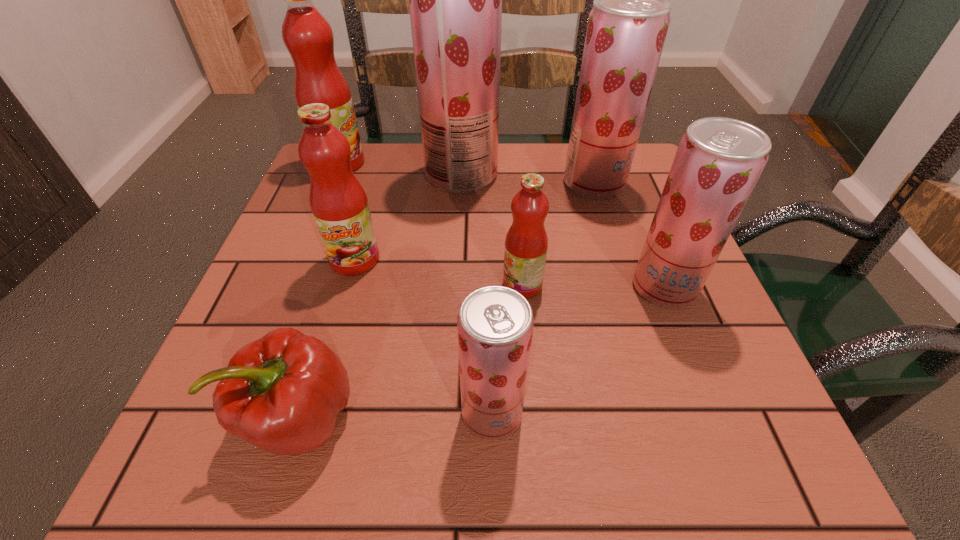
This screenshot has height=540, width=960. In order to click on vacant area situated on the back of the pepper in this screenshot , I will do `click(345, 269)`.

Where is `fruit juice at the near edge`? The image size is (960, 540). fruit juice at the near edge is located at coordinates (495, 324).

Locate an element on the screen. Image resolution: width=960 pixels, height=540 pixels. pepper situated at the near edge is located at coordinates (283, 392).

At what (x,y) coordinates should I click in order to perform the action: click on pepper that is at the left edge. Please return your answer as a coordinate pair (x, y). Looking at the image, I should click on (283, 392).

Identify the location of object that is at the far left corner. The image size is (960, 540). (307, 35).

The width and height of the screenshot is (960, 540). What are the coordinates of `object present at the near left corner` in the screenshot? It's located at (283, 392).

Where is `object located in the far right corner section of the desktop`? This screenshot has height=540, width=960. object located in the far right corner section of the desktop is located at coordinates point(627,26).

In order to click on vacant position at the far edge of the desktop in this screenshot , I will do `click(540, 168)`.

Image resolution: width=960 pixels, height=540 pixels. I want to click on vacant space at the left edge, so click(304, 213).

The width and height of the screenshot is (960, 540). I want to click on vacant region at the right edge of the desktop, so click(605, 204).